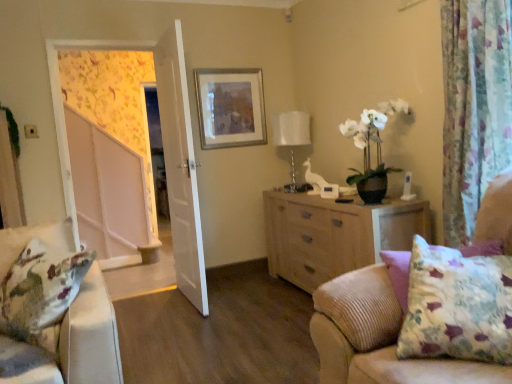
Question: Is light wood dresser at center directly adjacent to white glossy screen door at left?

Choices:
 (A) no
 (B) yes

Answer: (A)

Question: Is light wood dresser at center turned away from white glossy screen door at left?

Choices:
 (A) yes
 (B) no

Answer: (B)

Question: Would you consider light wood dresser at center to be distant from white glossy screen door at left?

Choices:
 (A) no
 (B) yes

Answer: (B)

Question: Is light wood dresser at center taller than white glossy screen door at left?

Choices:
 (A) yes
 (B) no

Answer: (B)

Question: Is light wood dresser at center oriented towards white glossy screen door at left?

Choices:
 (A) yes
 (B) no

Answer: (A)

Question: From a real-world perspective, is light wood dresser at center physically above white glossy screen door at left?

Choices:
 (A) no
 (B) yes

Answer: (A)

Question: Is light wood dresser at center further to camera compared to white wooden door at center?

Choices:
 (A) yes
 (B) no

Answer: (B)

Question: Is light wood dresser at center far away from white wooden door at center?

Choices:
 (A) no
 (B) yes

Answer: (A)

Question: Is light wood dresser at center to the right of white wooden door at center from the viewer's perspective?

Choices:
 (A) no
 (B) yes

Answer: (B)

Question: Are light wood dresser at center and white wooden door at center making contact?

Choices:
 (A) yes
 (B) no

Answer: (B)

Question: Is light wood dresser at center looking in the opposite direction of white wooden door at center?

Choices:
 (A) yes
 (B) no

Answer: (B)

Question: Considering the relative sizes of light wood dresser at center and white wooden door at center in the image provided, is light wood dresser at center smaller than white wooden door at center?

Choices:
 (A) no
 (B) yes

Answer: (A)

Question: Is floral fabric curtain at right located outside white glossy table lamp at upper center?

Choices:
 (A) no
 (B) yes

Answer: (B)